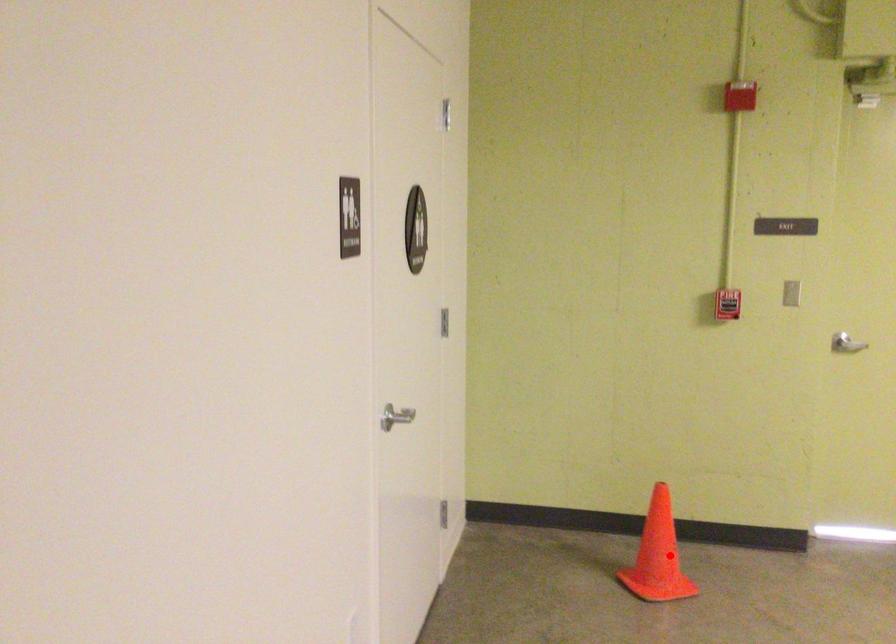
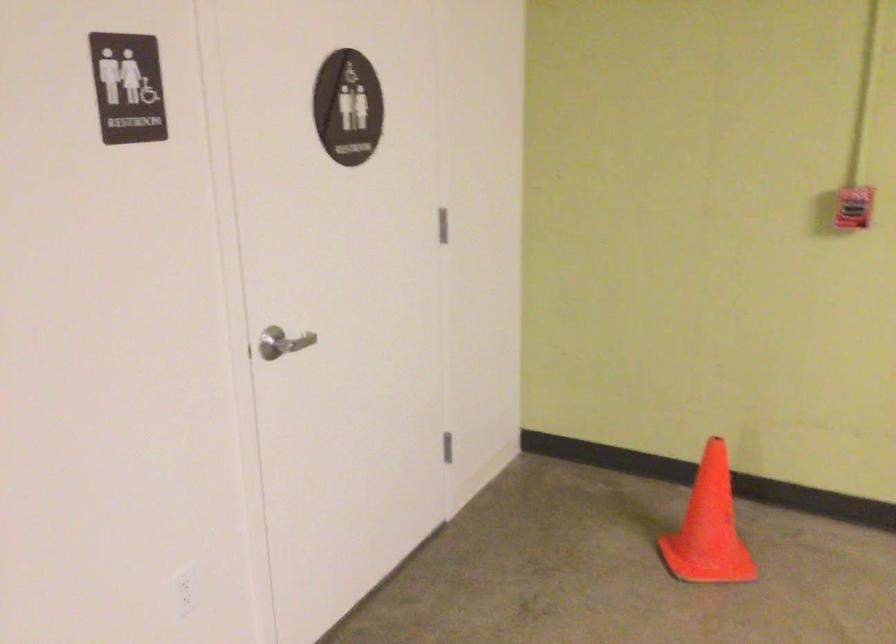
Question: A red point is marked in image1. In image2, is the corresponding 3D point closer to the camera or farther? Reply with the corresponding letter.

Choices:
 (A) The corresponding 3D point is closer.
 (B) The corresponding 3D point is farther.

Answer: (A)